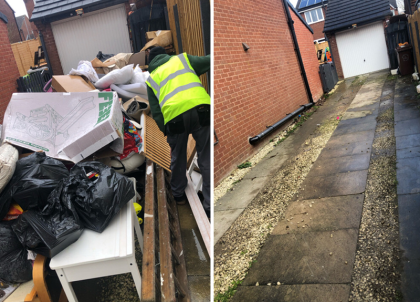
Where is `black trash bags`? This screenshot has height=302, width=420. black trash bags is located at coordinates (88, 195), (47, 181), (3, 256).